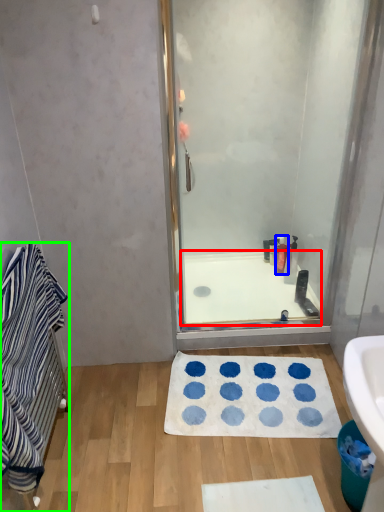
Question: Estimate the real-world distances between objects in this image. Which object is closer to bath (highlighted by a red box), toiletry (highlighted by a blue box) or bathroom cabinet (highlighted by a green box)?

Choices:
 (A) toiletry
 (B) bathroom cabinet

Answer: (A)